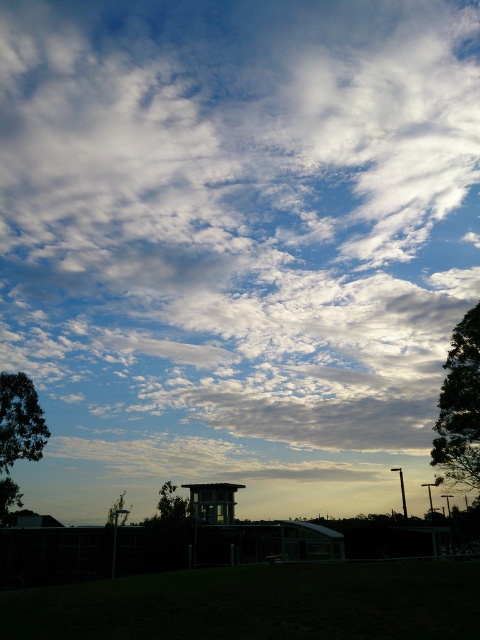
Question: Which of the following is the closest to the observer?

Choices:
 (A) (468, 396)
 (B) (119, 504)
 (C) (9, 433)

Answer: (A)

Question: Can you confirm if white fluffy cloud at upper center is bigger than green leafy tree at left?

Choices:
 (A) no
 (B) yes

Answer: (B)

Question: Is green leafy tree at left wider than green leafy tree at lower center?

Choices:
 (A) no
 (B) yes

Answer: (B)

Question: Which object is positioned farthest from the white fluffy cloud at upper center?

Choices:
 (A) green leafy tree at lower center
 (B) green leafy tree at left
 (C) green leafy tree at lower left

Answer: (A)

Question: Which point is closer to the camera taking this photo?

Choices:
 (A) (321, 384)
 (B) (468, 397)

Answer: (B)

Question: Does white fluffy cloud at upper center come behind green leafy tree at lower center?

Choices:
 (A) yes
 (B) no

Answer: (A)